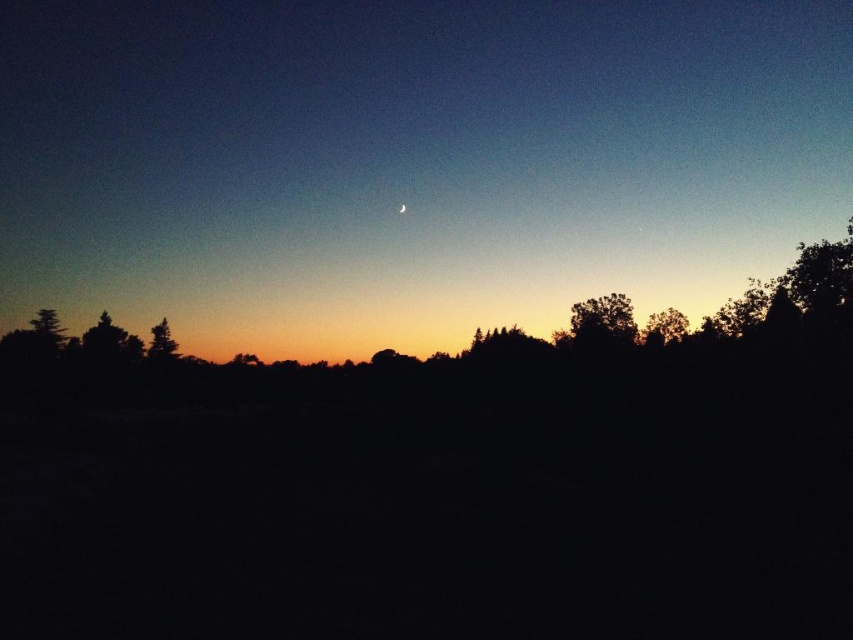
You are standing in the twilight scene and want to reach the point marked at coordinates (x=743, y=8). Considering the distance, is this point within a comfortable walking distance for an average person?

The point at (x=743, y=8) is 370.84 meters away from the viewer. Since an average person can comfortably walk up to 500 meters, this distance is within a comfortable walking range.

You are an observer standing in the twilight scene. You see the green matte tree at left and the green matte tree at lower left. Which tree has a larger width?

The green matte tree at left might be wider than the green matte tree at lower left according to the description.

You are an astronomer observing the twilight sky. You notice the silvery crescent moon at center and the green leafy tree at right. Which object appears bigger in the sky?

The silvery crescent moon at center appears bigger than the green leafy tree at right in the sky.